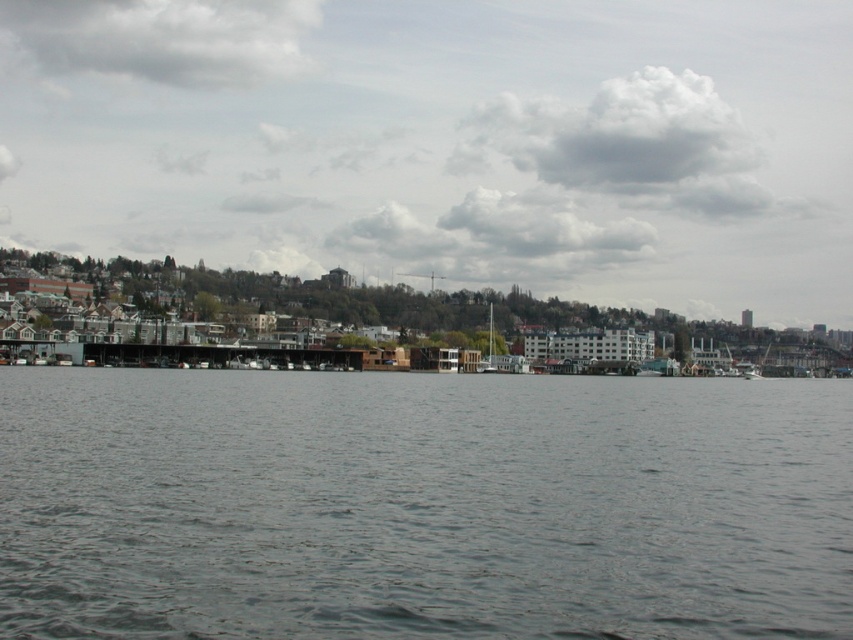
Question: Which point is farther from the camera taking this photo?

Choices:
 (A) (511, 358)
 (B) (142, 344)

Answer: (A)

Question: Where is gray water at center located in relation to white plastic boat at center in the image?

Choices:
 (A) left
 (B) right

Answer: (A)

Question: Can you confirm if gray water at center is bigger than white plastic boat at center?

Choices:
 (A) no
 (B) yes

Answer: (B)

Question: Which point appears closest to the camera in this image?

Choices:
 (A) coord(659,397)
 (B) coord(223,348)

Answer: (A)

Question: Which of the following is the closest to the observer?

Choices:
 (A) pyautogui.click(x=345, y=355)
 (B) pyautogui.click(x=746, y=576)
 (C) pyautogui.click(x=486, y=316)

Answer: (B)

Question: In this image, where is gray water at center located relative to brown wooden dock at center?

Choices:
 (A) right
 (B) left

Answer: (A)